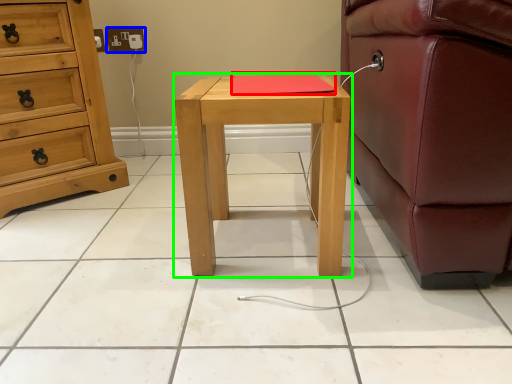
Question: Considering the real-world distances, which object is closest to pad (highlighted by a red box)? electric outlet (highlighted by a blue box) or nightstand (highlighted by a green box).

Choices:
 (A) electric outlet
 (B) nightstand

Answer: (B)